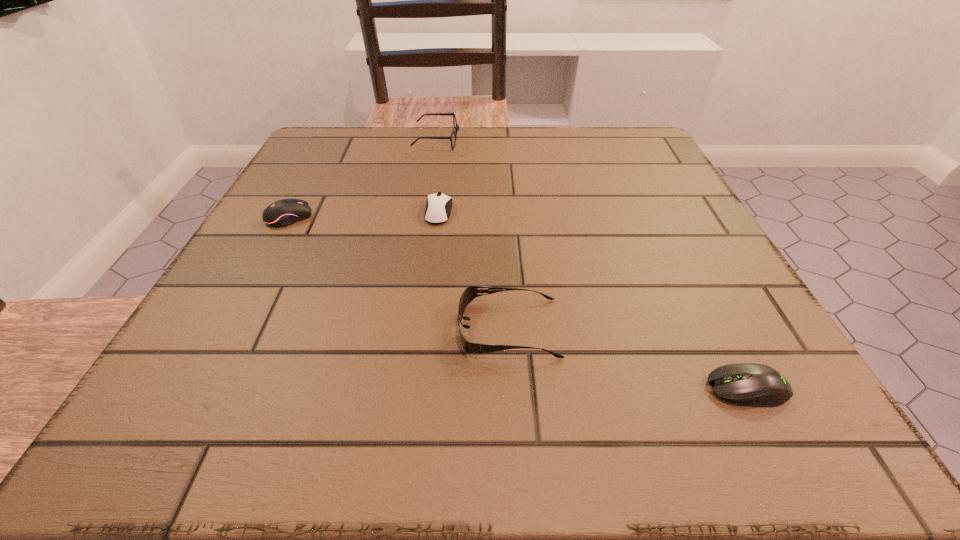
Find the location of a particular element. This screenshot has width=960, height=540. free space between the tallest object and the sunglasses is located at coordinates (473, 234).

Identify the location of blank region between the rightmost computer mouse and the tallest object. (592, 265).

This screenshot has height=540, width=960. What are the coordinates of `vacant area that lies between the farthest object and the rightmost computer mouse` in the screenshot? It's located at (592, 265).

This screenshot has width=960, height=540. Find the location of `free space between the rightmost computer mouse and the sunglasses`. free space between the rightmost computer mouse and the sunglasses is located at coordinates (628, 358).

This screenshot has width=960, height=540. Identify the location of free space between the second computer mouse from right to left and the tallest object. (438, 176).

Where is `vacant space that is in between the farthest object and the second computer mouse from left to right`? vacant space that is in between the farthest object and the second computer mouse from left to right is located at coordinates (438, 176).

Where is `empty space that is in between the leftmost object and the second object from right to left`? empty space that is in between the leftmost object and the second object from right to left is located at coordinates (399, 272).

Locate an element on the screen. This screenshot has height=540, width=960. free space between the leftmost computer mouse and the farthest object is located at coordinates (363, 179).

Find the location of a particular element. The image size is (960, 540). free point between the second computer mouse from right to left and the leftmost computer mouse is located at coordinates (364, 214).

At what (x,y) coordinates should I click in order to perform the action: click on object that is the closest one to the second computer mouse from left to right. Please return your answer as a coordinate pair (x, y). Looking at the image, I should click on click(x=456, y=127).